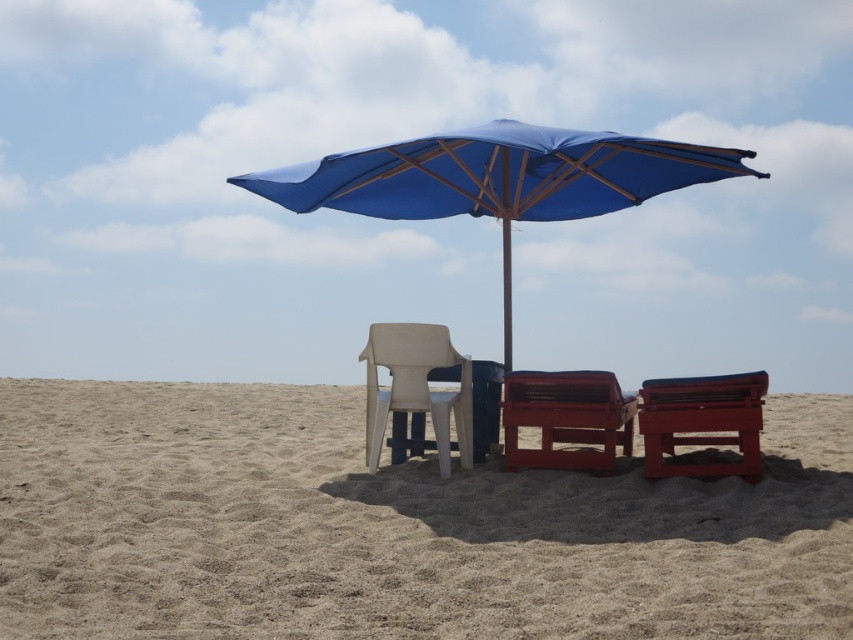
Does point (161, 408) lie in front of point (537, 129)?

That is False.

Describe the element at coordinates (393, 528) in the screenshot. I see `fine-grained sand at center` at that location.

Does point (140, 579) lie behind point (599, 138)?

No, (140, 579) is in front of (599, 138).

I want to click on fine-grained sand at center, so click(393, 528).

Is point (288, 520) less distant than point (583, 454)?

Yes, point (288, 520) is closer to viewer.

The image size is (853, 640). What do you see at coordinates (393, 528) in the screenshot?
I see `fine-grained sand at center` at bounding box center [393, 528].

This screenshot has width=853, height=640. I want to click on fine-grained sand at center, so click(393, 528).

Does point (561, 426) come farther from viewer compared to point (688, 412)?

Yes, it is.

Is matte red beach chair at center to the right of matte red plastic beach chair at lower right from the viewer's perspective?

Incorrect, matte red beach chair at center is not on the right side of matte red plastic beach chair at lower right.

Does point (558, 372) come closer to viewer compared to point (747, 465)?

No, it is not.

You are a GUI agent. You are given a task and a screenshot of the screen. Output one action in this format:
    pyautogui.click(x=<x>, y=<y>)
    Task: Click on the matte red beach chair at center
    
    Given the screenshot: What is the action you would take?
    pyautogui.click(x=566, y=417)